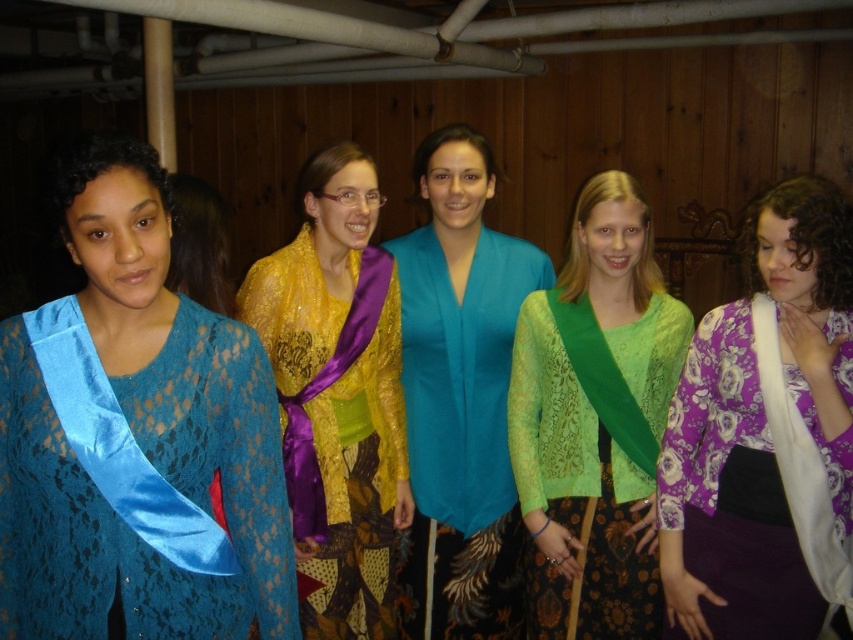
At what (x,y) coordinates should I click in order to perform the action: click on blue satin sash at left. Please return your answer as a coordinate pair (x, y). Looking at the image, I should click on (138, 433).

Which is behind, point (207, 412) or point (440, 280)?

Point (440, 280)

In order to click on blue satin sash at left in this screenshot , I will do `click(138, 433)`.

Is purple floral kimono at right further to the viewer compared to satin blue sash at left?

Yes.

Where is `purple floral kimono at right`? purple floral kimono at right is located at coordinates (759, 429).

Who is positioned more to the left, shiny purple sash at center or teal satin blouse at center?

From the viewer's perspective, shiny purple sash at center appears more on the left side.

From the picture: Does shiny purple sash at center have a larger size compared to teal satin blouse at center?

Correct, shiny purple sash at center is larger in size than teal satin blouse at center.

The width and height of the screenshot is (853, 640). I want to click on shiny purple sash at center, so click(337, 394).